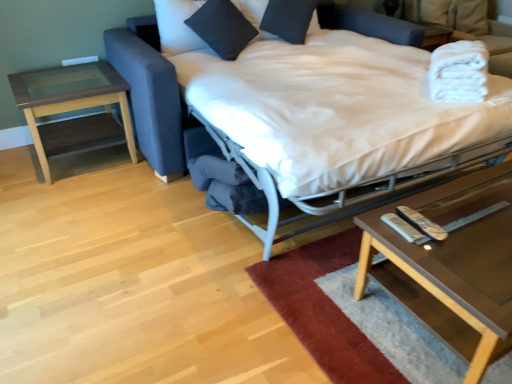
Question: Can you confirm if white fabric bed at center is positioned to the left of white plastic remote at lower right, the first remote viewed from the left?

Choices:
 (A) no
 (B) yes

Answer: (B)

Question: From a real-world perspective, does white fabric bed at center stand above white plastic remote at lower right, the first remote viewed from the left?

Choices:
 (A) yes
 (B) no

Answer: (B)

Question: Is white fabric bed at center further to camera compared to white plastic remote at lower right, the first remote viewed from the left?

Choices:
 (A) no
 (B) yes

Answer: (A)

Question: Does white fabric bed at center have a larger size compared to white plastic remote at lower right, the second remote viewed from the right?

Choices:
 (A) no
 (B) yes

Answer: (B)

Question: From the image's perspective, would you say white fabric bed at center is positioned over white plastic remote at lower right, the second remote viewed from the right?

Choices:
 (A) yes
 (B) no

Answer: (A)

Question: Is soft wool rug at lower center inside the boundaries of white plastic remote at lower right, the 2th remote in the left-to-right sequence, or outside?

Choices:
 (A) inside
 (B) outside

Answer: (B)

Question: Considering the positions of soft wool rug at lower center and white plastic remote at lower right, marked as the 1th remote in a right-to-left arrangement, in the image, is soft wool rug at lower center wider or thinner than white plastic remote at lower right, marked as the 1th remote in a right-to-left arrangement,?

Choices:
 (A) thin
 (B) wide

Answer: (B)

Question: From a real-world perspective, is soft wool rug at lower center physically located above or below white plastic remote at lower right, marked as the 1th remote in a right-to-left arrangement?

Choices:
 (A) above
 (B) below

Answer: (B)

Question: Relative to white plastic remote at lower right, the 2th remote in the left-to-right sequence, is soft wool rug at lower center in front or behind?

Choices:
 (A) behind
 (B) front

Answer: (B)

Question: In the image, is white plastic remote at lower right, the first remote viewed from the left, positioned in front of or behind white plastic remote at lower right, the 2th remote in the left-to-right sequence?

Choices:
 (A) behind
 (B) front

Answer: (B)

Question: Visually, is white plastic remote at lower right, the first remote viewed from the left, positioned to the left or to the right of white plastic remote at lower right, the 2th remote in the left-to-right sequence?

Choices:
 (A) left
 (B) right

Answer: (A)

Question: From a real-world perspective, relative to white plastic remote at lower right, the 2th remote in the left-to-right sequence, is white plastic remote at lower right, the second remote viewed from the right, vertically above or below?

Choices:
 (A) below
 (B) above

Answer: (A)

Question: From the image's perspective, is white plastic remote at lower right, the second remote viewed from the right, positioned above or below white plastic remote at lower right, marked as the 1th remote in a right-to-left arrangement?

Choices:
 (A) below
 (B) above

Answer: (A)

Question: Looking at their shapes, would you say clear glass coffee table at lower right is wider or thinner than black cotton pillow at upper center, arranged as the first pillow when viewed from the left?

Choices:
 (A) wide
 (B) thin

Answer: (A)

Question: Would you say clear glass coffee table at lower right is to the left or to the right of black cotton pillow at upper center, arranged as the first pillow when viewed from the left, in the picture?

Choices:
 (A) right
 (B) left

Answer: (A)